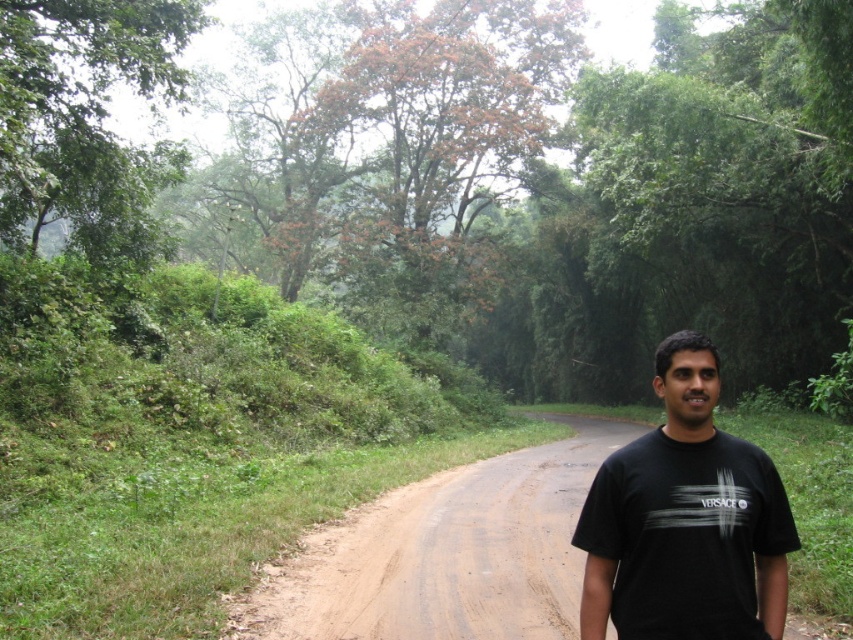
Looking at this image, between brown dirt track at center and black matte t-shirt at center, which one appears on the right side from the viewer's perspective?

From the viewer's perspective, brown dirt track at center appears more on the right side.

Between point (309, 576) and point (779, 531), which one is positioned behind?

Positioned behind is point (309, 576).

This screenshot has height=640, width=853. Find the location of `brown dirt track at center`. brown dirt track at center is located at coordinates (445, 554).

The height and width of the screenshot is (640, 853). What are the coordinates of `brown dirt track at center` in the screenshot? It's located at (445, 554).